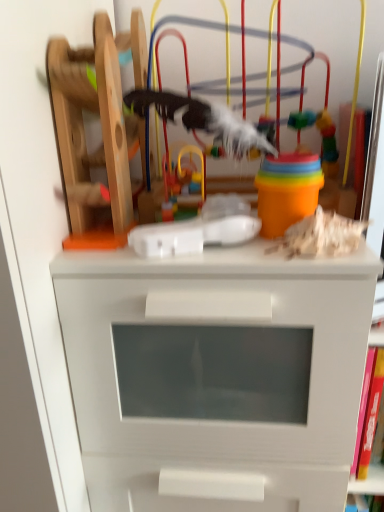
Measure the distance between point (307, 247) and camera.

Point (307, 247) is 50.80 centimeters away from camera.

Describe the element at coordinates (102, 127) in the screenshot. I see `wooden toy at upper center, the second toy positioned from the right` at that location.

The width and height of the screenshot is (384, 512). What are the coordinates of `wooden roller coaster at left, the 1th toy from the left` in the screenshot? It's located at 102,130.

Describe the element at coordinates (216, 374) in the screenshot. I see `white matte chest of drawers at center` at that location.

Locate an element on the screen. The height and width of the screenshot is (512, 384). wooden toy at upper right, positioned as the 4th toy in left-to-right order is located at coordinates (321, 234).

Considering the sizes of objects wooden toy at upper center, the second toy positioned from the right, and multicolored plastic toy at center, which appears as the 3th toy when viewed from the right, in the image provided, who is wider, wooden toy at upper center, the second toy positioned from the right, or multicolored plastic toy at center, which appears as the 3th toy when viewed from the right,?

Wider between the two is wooden toy at upper center, the second toy positioned from the right.

Is multicolored plastic toy at center, which is the 2th toy in left-to-right order, at the back of wooden toy at upper center, the second toy positioned from the right?

No, wooden toy at upper center, the second toy positioned from the right, is not facing the opposite direction of multicolored plastic toy at center, which is the 2th toy in left-to-right order.

Who is smaller, wooden toy at upper center, the second toy positioned from the right, or multicolored plastic toy at center, which is the 2th toy in left-to-right order?

Smaller between the two is multicolored plastic toy at center, which is the 2th toy in left-to-right order.

Is white matte chest of drawers at center smaller than multicolored plastic toy at center, which is the 2th toy in left-to-right order?

Actually, white matte chest of drawers at center might be larger than multicolored plastic toy at center, which is the 2th toy in left-to-right order.

Between white matte chest of drawers at center and multicolored plastic toy at center, which appears as the 3th toy when viewed from the right, which one has smaller width?

multicolored plastic toy at center, which appears as the 3th toy when viewed from the right, is thinner.

From a real-world perspective, is white matte chest of drawers at center beneath multicolored plastic toy at center, which is the 2th toy in left-to-right order?

Yes, from a real-world perspective, white matte chest of drawers at center is under multicolored plastic toy at center, which is the 2th toy in left-to-right order.

Is white matte chest of drawers at center closer to the viewer compared to multicolored plastic toy at center, which appears as the 3th toy when viewed from the right?

That is True.

Can you tell me how much wooden toy at upper right, positioned as the 4th toy in left-to-right order, and white matte chest of drawers at center differ in facing direction?

The angle between the facing direction of wooden toy at upper right, positioned as the 4th toy in left-to-right order, and the facing direction of white matte chest of drawers at center is 10.1 degrees.

From a real-world perspective, is wooden toy at upper right, which appears as the first toy when viewed from the right, positioned above or below white matte chest of drawers at center?

wooden toy at upper right, which appears as the first toy when viewed from the right, is situated higher than white matte chest of drawers at center in the real world.

In the scene shown: Considering the positions of objects wooden toy at upper right, positioned as the 4th toy in left-to-right order, and white matte chest of drawers at center in the image provided, who is more to the right, wooden toy at upper right, positioned as the 4th toy in left-to-right order, or white matte chest of drawers at center?

Positioned to the right is wooden toy at upper right, positioned as the 4th toy in left-to-right order.

From the image's perspective, which one is positioned higher, wooden toy at upper right, positioned as the 4th toy in left-to-right order, or white matte chest of drawers at center?

wooden toy at upper right, positioned as the 4th toy in left-to-right order, from the image's perspective.

Between wooden toy at upper center, which appears as the 3th toy when viewed from the left, and white matte chest of drawers at center, which one is positioned behind?

wooden toy at upper center, which appears as the 3th toy when viewed from the left.

Between wooden toy at upper center, the second toy positioned from the right, and white matte chest of drawers at center, which one has less height?

wooden toy at upper center, the second toy positioned from the right, is shorter.

At what (x,y) coordinates should I click in order to perform the action: click on the 1st toy counting from the right of the white matte chest of drawers at center. Please return your answer as a coordinate pair (x, y). Image resolution: width=384 pixels, height=512 pixels. Looking at the image, I should click on (102, 127).

Does wooden toy at upper center, which appears as the 3th toy when viewed from the left, turn towards white matte chest of drawers at center?

No, wooden toy at upper center, which appears as the 3th toy when viewed from the left, does not turn towards white matte chest of drawers at center.

Does white matte chest of drawers at center have a smaller size compared to wooden toy at upper right, positioned as the 4th toy in left-to-right order?

No, white matte chest of drawers at center is not smaller than wooden toy at upper right, positioned as the 4th toy in left-to-right order.

Which object is further away from the camera, white matte chest of drawers at center or wooden toy at upper right, positioned as the 4th toy in left-to-right order?

wooden toy at upper right, positioned as the 4th toy in left-to-right order, is more distant.

Would you consider white matte chest of drawers at center to be distant from wooden toy at upper right, positioned as the 4th toy in left-to-right order?

They are positioned close to each other.

From the image's perspective, which is below, white matte chest of drawers at center or wooden toy at upper right, which appears as the first toy when viewed from the right?

white matte chest of drawers at center appears lower in the image.

Is wooden toy at upper center, the second toy positioned from the right, bigger than wooden toy at upper right, which appears as the first toy when viewed from the right?

Yes.

At what (x,y) coordinates should I click in order to perform the action: click on the 3rd toy located above the wooden toy at upper right, which appears as the first toy when viewed from the right (from a real-world perspective). Please return your answer as a coordinate pair (x, y). Looking at the image, I should click on (102, 127).

Can you confirm if wooden toy at upper center, which appears as the 3th toy when viewed from the left, is taller than wooden toy at upper right, which appears as the first toy when viewed from the right?

Yes.

Considering the positions of point (102, 31) and point (358, 239), is point (102, 31) closer or farther from the camera than point (358, 239)?

Point (102, 31) is farther from the camera than point (358, 239).

Is wooden toy at upper center, which appears as the 3th toy when viewed from the left, a part of multicolored plastic toy at center, which appears as the 3th toy when viewed from the right?

No, multicolored plastic toy at center, which appears as the 3th toy when viewed from the right, does not contain wooden toy at upper center, which appears as the 3th toy when viewed from the left.

Can you confirm if multicolored plastic toy at center, which is the 2th toy in left-to-right order, is wider than wooden toy at upper center, the second toy positioned from the right?

In fact, multicolored plastic toy at center, which is the 2th toy in left-to-right order, might be narrower than wooden toy at upper center, the second toy positioned from the right.

From a real-world perspective, is multicolored plastic toy at center, which is the 2th toy in left-to-right order, physically located above or below wooden toy at upper center, which appears as the 3th toy when viewed from the left?

Clearly, from a real-world perspective, multicolored plastic toy at center, which is the 2th toy in left-to-right order, is below wooden toy at upper center, which appears as the 3th toy when viewed from the left.

Between multicolored plastic toy at center, which appears as the 3th toy when viewed from the right, and wooden toy at upper center, which appears as the 3th toy when viewed from the left, which one has larger size?

wooden toy at upper center, which appears as the 3th toy when viewed from the left, is bigger.

Which toy is the 1st one when counting from the front of the multicolored plastic toy at center, which is the 2th toy in left-to-right order? Please provide its 2D coordinates.

[(102, 127)]

In order to click on toy that is the 1st one when counting leftward from the white matte chest of drawers at center in this screenshot , I will do `click(183, 181)`.

Considering their positions, is wooden toy at upper center, which appears as the 3th toy when viewed from the left, positioned further to multicolored plastic toy at center, which is the 2th toy in left-to-right order, than wooden roller coaster at left, the 1th toy from the left?

Among the two, wooden toy at upper center, which appears as the 3th toy when viewed from the left, is located further to multicolored plastic toy at center, which is the 2th toy in left-to-right order.

From the image, which object appears to be farther from wooden roller coaster at left, which appears as the 4th toy when viewed from the right, multicolored plastic toy at center, which is the 2th toy in left-to-right order, or white matte chest of drawers at center?

Among the two, white matte chest of drawers at center is located further to wooden roller coaster at left, which appears as the 4th toy when viewed from the right.

Considering their positions, is wooden toy at upper right, which appears as the first toy when viewed from the right, positioned closer to white matte chest of drawers at center than wooden roller coaster at left, the 1th toy from the left?

wooden toy at upper right, which appears as the first toy when viewed from the right.

From the image, which object appears to be farther from wooden toy at upper center, which appears as the 3th toy when viewed from the left, multicolored plastic toy at center, which is the 2th toy in left-to-right order, or wooden roller coaster at left, the 1th toy from the left?

Result: multicolored plastic toy at center, which is the 2th toy in left-to-right order, is further to wooden toy at upper center, which appears as the 3th toy when viewed from the left.

Which object lies nearer to the anchor point multicolored plastic toy at center, which appears as the 3th toy when viewed from the right, wooden roller coaster at left, the 1th toy from the left, or wooden toy at upper right, positioned as the 4th toy in left-to-right order?

The object closer to multicolored plastic toy at center, which appears as the 3th toy when viewed from the right, is wooden roller coaster at left, the 1th toy from the left.

Looking at the image, which one is located closer to multicolored plastic toy at center, which is the 2th toy in left-to-right order, wooden toy at upper center, which appears as the 3th toy when viewed from the left, or white matte chest of drawers at center?

wooden toy at upper center, which appears as the 3th toy when viewed from the left.

From the image, which object appears to be farther from wooden toy at upper center, the second toy positioned from the right, white matte chest of drawers at center or multicolored plastic toy at center, which appears as the 3th toy when viewed from the right?

Among the two, white matte chest of drawers at center is located further to wooden toy at upper center, the second toy positioned from the right.

From the image, which object appears to be nearer to wooden toy at upper center, which appears as the 3th toy when viewed from the left, wooden toy at upper right, positioned as the 4th toy in left-to-right order, or white matte chest of drawers at center?

The object closer to wooden toy at upper center, which appears as the 3th toy when viewed from the left, is white matte chest of drawers at center.

Locate an element on the screen. The image size is (384, 512). toy between multicolored plastic toy at center, which appears as the 3th toy when viewed from the right, and white matte chest of drawers at center in the up-down direction is located at coordinates point(321,234).

Locate an element on the screen. toy located between wooden roller coaster at left, the 1th toy from the left, and wooden toy at upper center, which appears as the 3th toy when viewed from the left, in the left-right direction is located at coordinates (183, 181).